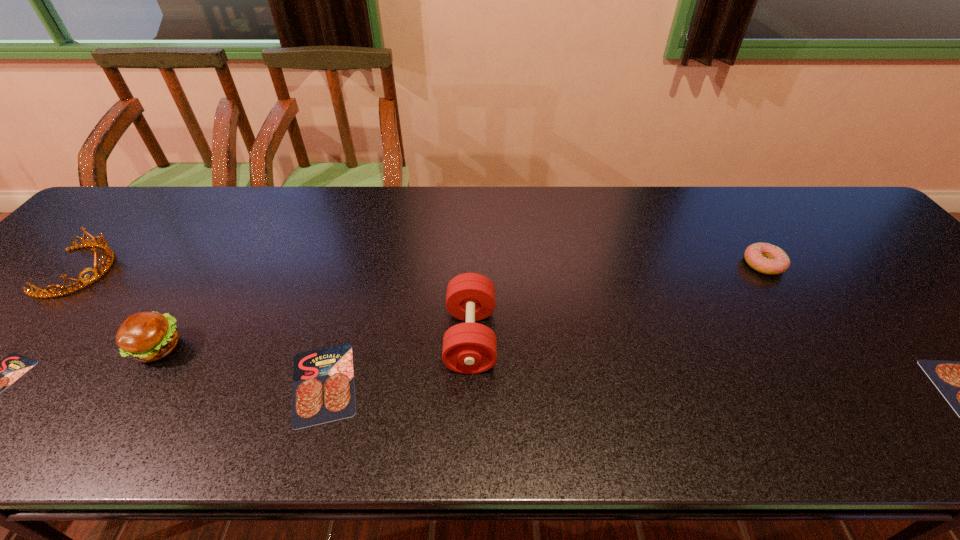
Locate an element on the screen. the second salami from right to left is located at coordinates (323, 380).

Locate an element on the screen. Image resolution: width=960 pixels, height=540 pixels. the second shortest object is located at coordinates (323, 380).

Locate an element on the screen. tiara is located at coordinates (109, 255).

Locate an element on the screen. This screenshot has width=960, height=540. the second object from right to left is located at coordinates (765, 258).

Identify the location of doughnut. The height and width of the screenshot is (540, 960). (765, 258).

The image size is (960, 540). Identify the location of hamburger. (145, 336).

The height and width of the screenshot is (540, 960). I want to click on the fifth object from left to right, so pyautogui.click(x=469, y=348).

Find the location of `the tallest object`. the tallest object is located at coordinates (469, 348).

Where is `free space located on the right of the second shortest object`? This screenshot has height=540, width=960. free space located on the right of the second shortest object is located at coordinates tap(392, 383).

The height and width of the screenshot is (540, 960). Find the location of `free spot located 0.350m on the front-facing side of the tiara`. free spot located 0.350m on the front-facing side of the tiara is located at coordinates (249, 271).